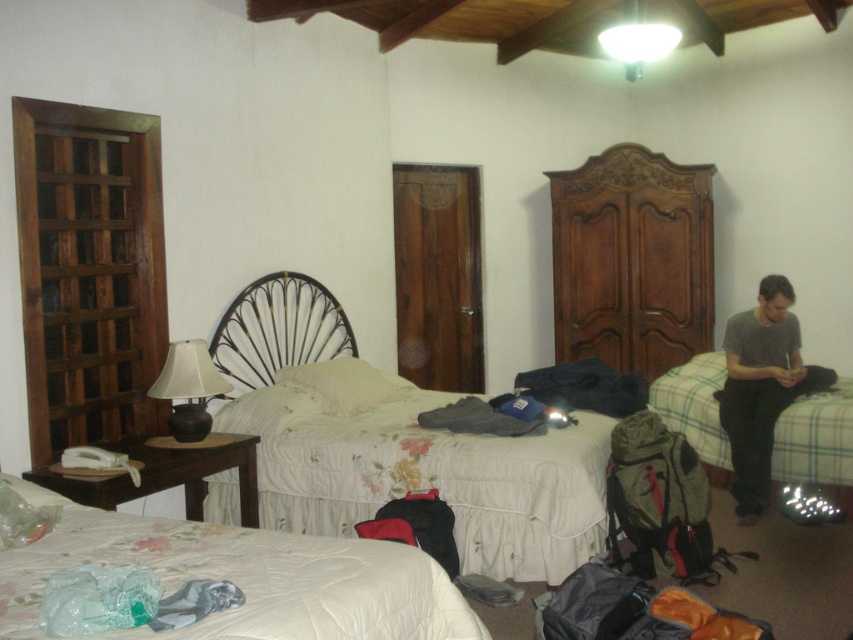
Question: Can you confirm if gray cotton shirt at right is positioned to the right of green plaid bed at right?

Choices:
 (A) no
 (B) yes

Answer: (B)

Question: Which object is positioned closest to the gray cotton shirt at right?

Choices:
 (A) brown polished wood armoire at center right
 (B) wooden lattice door at left
 (C) iron/textured headboard at center

Answer: (A)

Question: Does white floral bedspread at lower left appear on the left side of green plaid bed at right?

Choices:
 (A) yes
 (B) no

Answer: (A)

Question: Estimate the real-world distances between objects in this image. Which object is farther from the brown polished wood armoire at center right?

Choices:
 (A) floral fabric bed at center
 (B) iron/textured headboard at center
 (C) green plaid bed at right
 (D) matte black lamp at left

Answer: (D)

Question: Based on their relative distances, which object is nearer to the white floral bedspread at lower left?

Choices:
 (A) green plaid bed at right
 (B) brown polished wood armoire at center right
 (C) iron/textured headboard at center

Answer: (C)

Question: Can you confirm if green plaid bed at right is positioned to the right of matte black lamp at left?

Choices:
 (A) no
 (B) yes

Answer: (B)